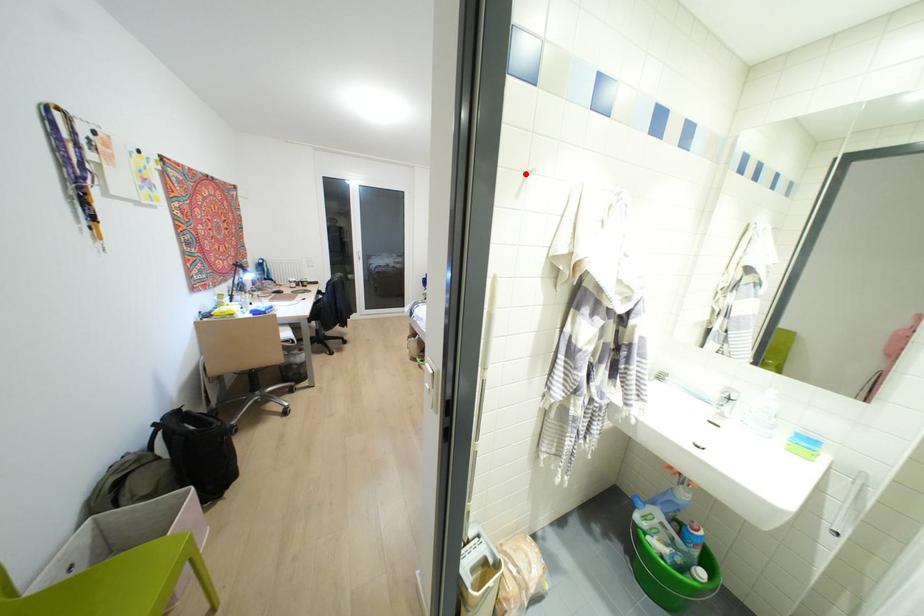
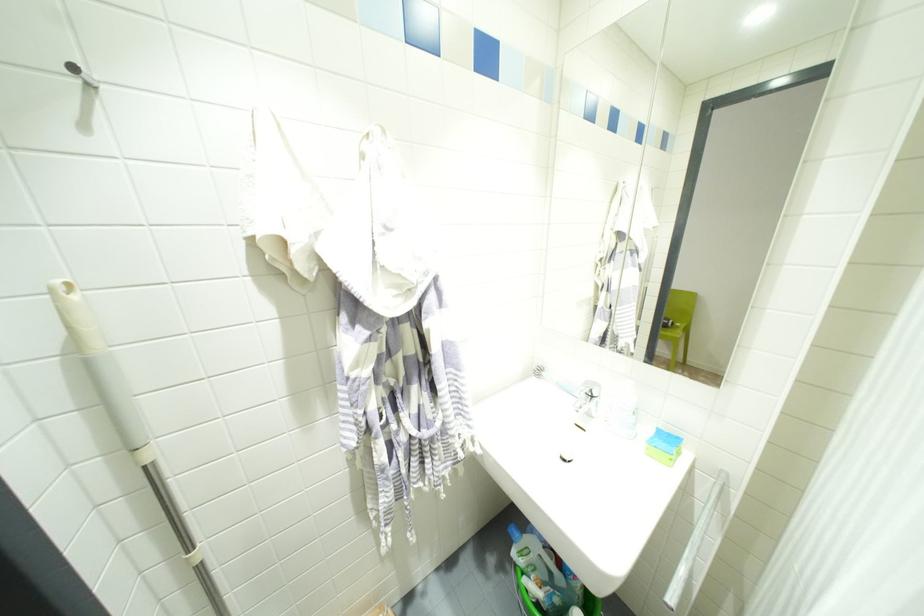
In the second image, find the point that corresponds to the highlighted location in the first image.

(91, 84)